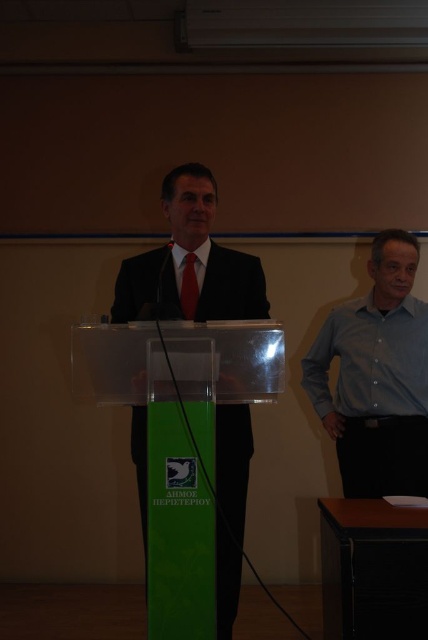
Question: Which object is farther from the camera taking this photo?

Choices:
 (A) matte black suit at center
 (B) light blue button-down shirt at right
 (C) red satin tie at center
 (D) green plastic podium at center

Answer: (B)

Question: Which object is the farthest from the matte black suit at center?

Choices:
 (A) red satin tie at center
 (B) green plastic podium at center
 (C) light blue button-down shirt at right

Answer: (B)

Question: Does green plastic podium at center lie behind red satin tie at center?

Choices:
 (A) no
 (B) yes

Answer: (A)

Question: Does light blue button-down shirt at right come behind red satin tie at center?

Choices:
 (A) no
 (B) yes

Answer: (B)

Question: Can you confirm if matte black suit at center is positioned above green plastic podium at center?

Choices:
 (A) yes
 (B) no

Answer: (A)

Question: Which of the following is the farthest from the observer?

Choices:
 (A) green plastic podium at center
 (B) red satin tie at center

Answer: (B)